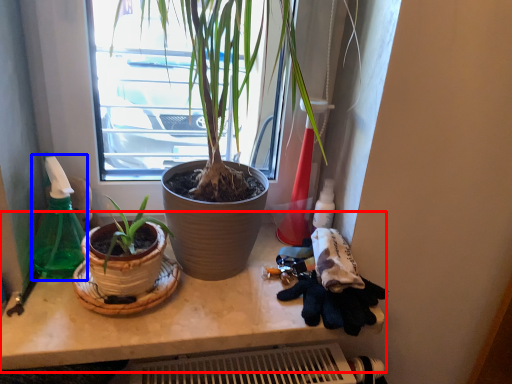
Question: Among these objects, which one is farthest to the camera, counter (highlighted by a red box) or bottle (highlighted by a blue box)?

Choices:
 (A) counter
 (B) bottle

Answer: (B)